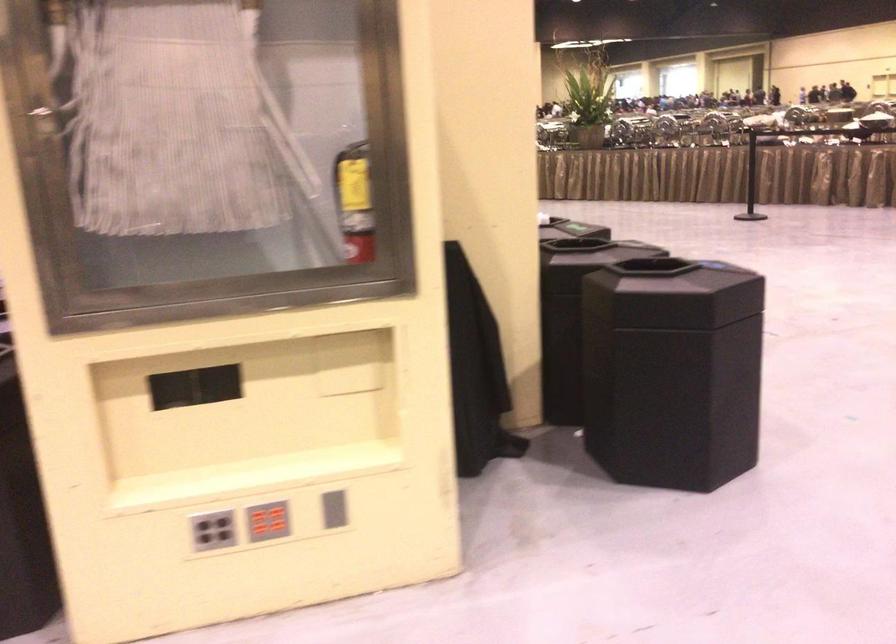
Identify the location of red button panel. (268, 521).